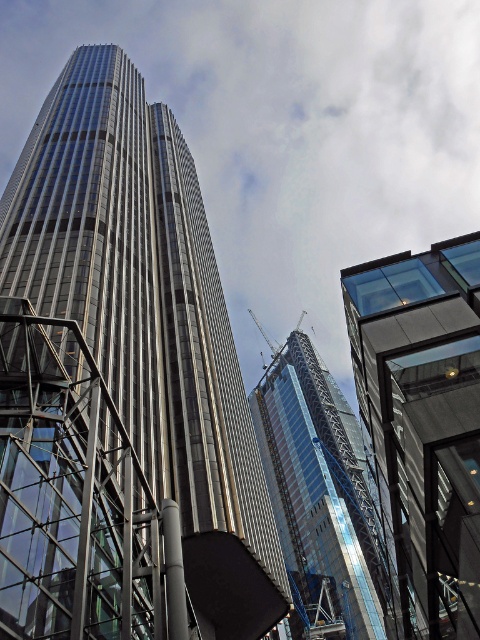
You are an architect analyzing the urban scene. Which skyscraper, the glassy metallic skyscraper at center or the glassy steel skyscraper at center, has a greater width according to the description?

The glassy metallic skyscraper at center might be wider than the glassy steel skyscraper at center according to the description.

You are standing in the middle of a city square and see the glassy metallic skyscraper at center and the glassy steel skyscraper at center. Which skyscraper is positioned to the left?

The glassy metallic skyscraper at center is positioned to the left of the glassy steel skyscraper at center.

You are a city planner assessing the distance between two buildings for safety regulations. The minimum required distance between any two buildings in this area is 120 feet. Based on the image, can you confirm if the distance between the glassy metallic skyscraper at center and the glassy reflective building at right meets the safety requirement?

The glassy metallic skyscraper at center is 137.74 feet from the glassy reflective building at right. Since 137.74 feet exceeds the minimum required distance of 120 feet, the safety requirement is met.